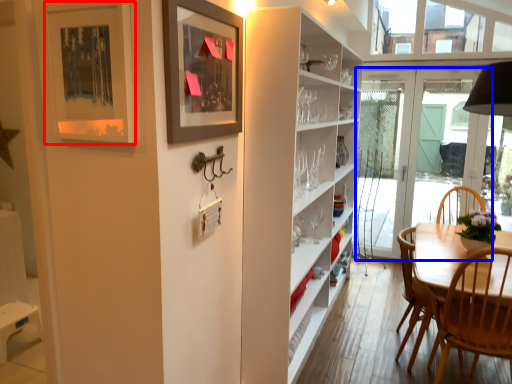
Question: Which object is further to the camera taking this photo, picture frame (highlighted by a red box) or door (highlighted by a blue box)?

Choices:
 (A) picture frame
 (B) door

Answer: (B)